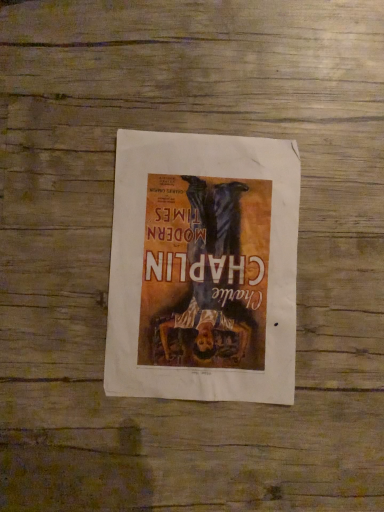
Identify the location of matte paper poster at center. The height and width of the screenshot is (512, 384). (203, 268).

This screenshot has height=512, width=384. Describe the element at coordinates (203, 268) in the screenshot. I see `matte paper poster at center` at that location.

Measure the distance between matte paper poster at center and camera.

matte paper poster at center and camera are 18.21 inches apart from each other.

You are a GUI agent. You are given a task and a screenshot of the screen. Output one action in this format:
    pyautogui.click(x=<x>, y=<y>)
    Task: Click on the matte paper poster at center
    Image resolution: width=384 pixels, height=512 pixels.
    Given the screenshot: What is the action you would take?
    [x=203, y=268]